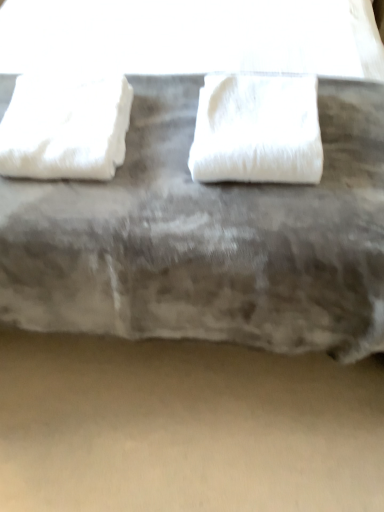
You are a GUI agent. You are given a task and a screenshot of the screen. Output one action in this format:
    pyautogui.click(x=<x>, y=<y>)
    Task: Click on the vacant region above beige matte concrete at lower center (from a real-world perspective)
    The image size is (384, 512).
    Given the screenshot: What is the action you would take?
    pyautogui.click(x=197, y=446)